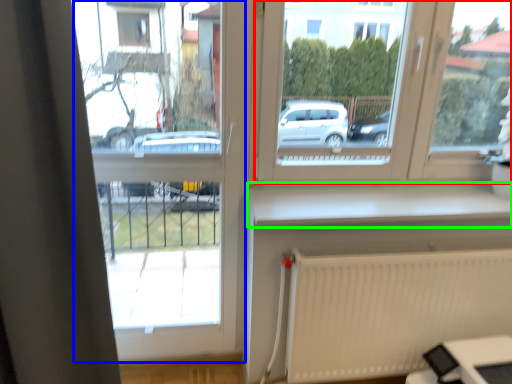
Question: Which is nearer to the window (highlighted by a red box)? window frame (highlighted by a blue box) or window sill (highlighted by a green box).

Choices:
 (A) window frame
 (B) window sill

Answer: (B)